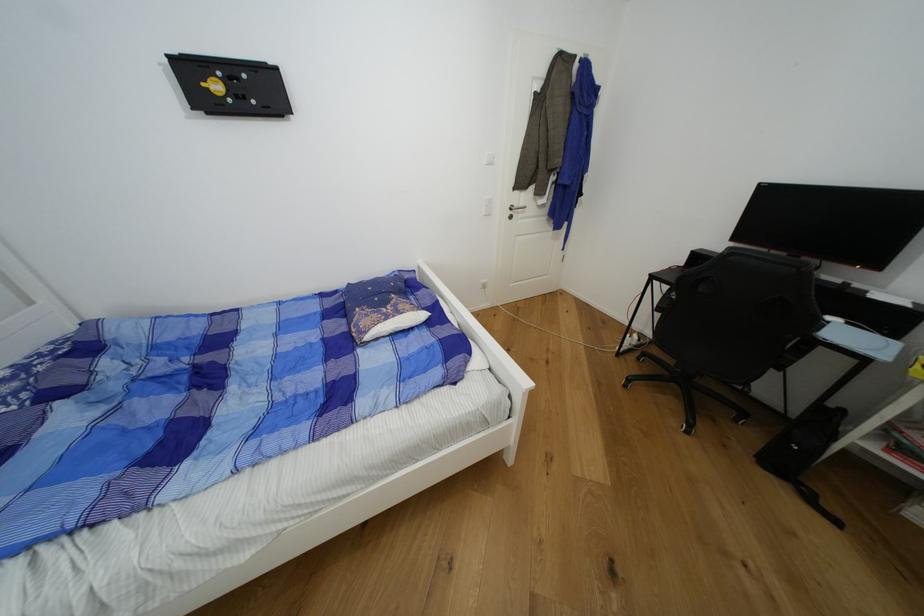
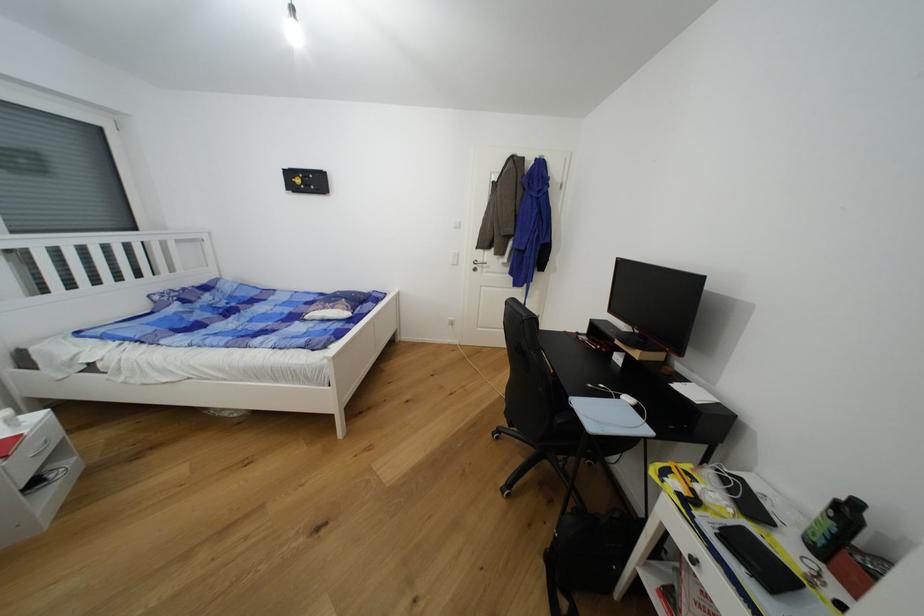
Find the pixel in the second image that matches [404,314] in the first image.

(337, 310)